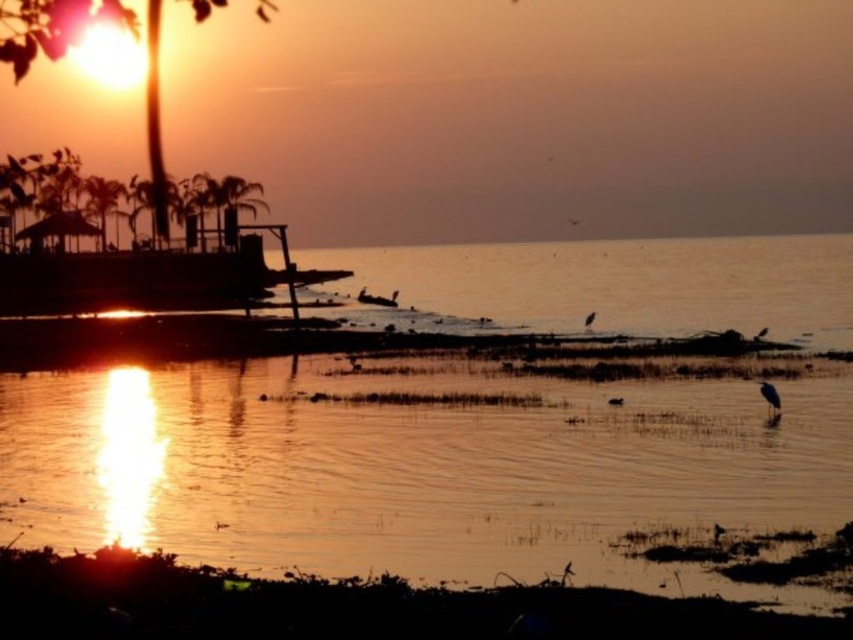
Question: Which object appears farthest from the camera in this image?

Choices:
 (A) gray matte bird at lower right
 (B) green leafy palm tree at upper left
 (C) brown feathered bird at center

Answer: (B)

Question: Which of these objects is positioned closest to the gray matte bird at lower right?

Choices:
 (A) green leafy palm tree at upper left
 (B) shiny golden water at center
 (C) brown feathered bird at center
 (D) white matte bird at center

Answer: (D)

Question: Does brown feathered bird at center appear under silvery feathered bird at center?

Choices:
 (A) yes
 (B) no

Answer: (B)

Question: Can you confirm if shiny golden water at center is smaller than green leafy palm tree at upper left?

Choices:
 (A) no
 (B) yes

Answer: (A)

Question: Which object is positioned farthest from the white matte bird at center?

Choices:
 (A) brown feathered bird at center
 (B) gray matte bird at lower right

Answer: (A)

Question: Is shiny golden water at center behind silvery feathered bird at center?

Choices:
 (A) no
 (B) yes

Answer: (A)